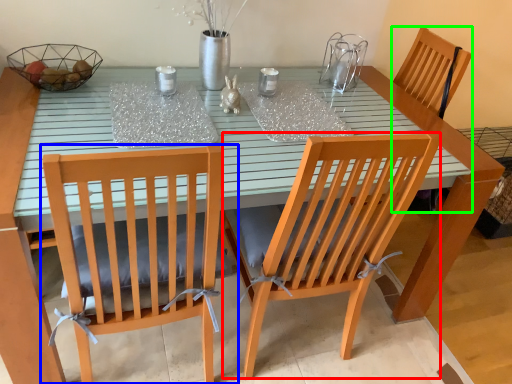
Question: Which is farther away from chair (highlighted by a red box)? chair (highlighted by a blue box) or armchair (highlighted by a green box)?

Choices:
 (A) chair
 (B) armchair

Answer: (B)